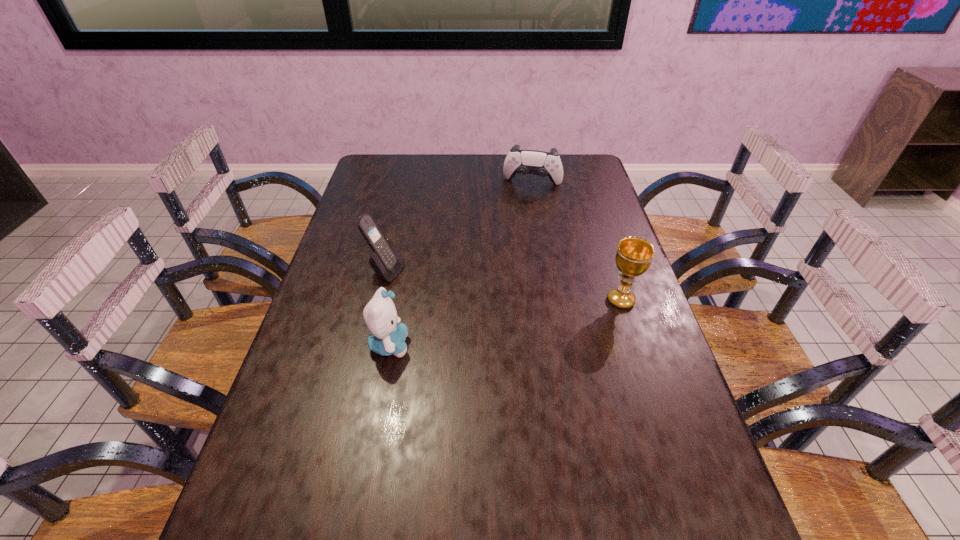
In the image, there is a desktop. Where is `vacant area at the near edge`? vacant area at the near edge is located at coordinates (449, 490).

The width and height of the screenshot is (960, 540). In order to click on vacant space at the left edge of the desktop in this screenshot , I will do [325, 435].

Identify the location of vacant area at the right edge of the desktop. (577, 260).

Locate an element on the screen. The height and width of the screenshot is (540, 960). vacant space at the far right corner of the desktop is located at coordinates point(595,174).

In the image, there is a desktop. Identify the location of vacant space at the near right corner. 713,512.

This screenshot has width=960, height=540. What are the coordinates of `empty space between the rightmost object and the second farthest object` in the screenshot? It's located at (503, 286).

The width and height of the screenshot is (960, 540). In order to click on free point between the second nearest object and the nearest object in this screenshot , I will do `click(505, 322)`.

I want to click on empty space between the kitten and the second object from right to left, so click(461, 264).

The width and height of the screenshot is (960, 540). Identify the location of vacant area that lies between the second object from right to left and the second nearest object. (577, 242).

Identify the location of free spot between the kitten and the third farthest object. (505, 322).